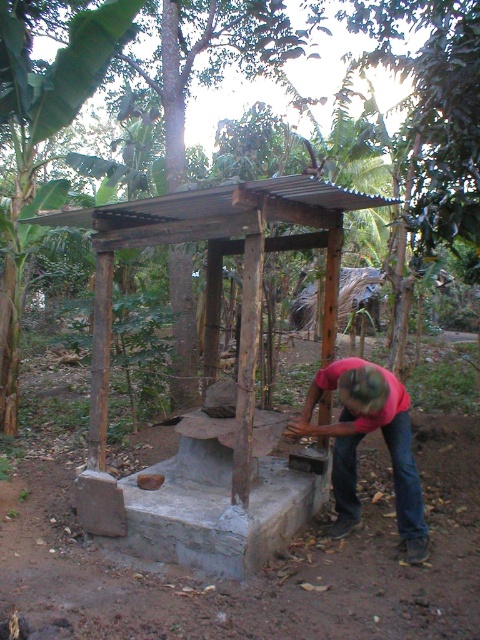
Question: Observing the image, what is the correct spatial positioning of rustic wooden gazebo at center in reference to red fabric shirt at center?

Choices:
 (A) right
 (B) left

Answer: (B)

Question: Which point appears closest to the camera in this image?

Choices:
 (A) (310, 390)
 (B) (100, 422)

Answer: (A)

Question: Which object is farther from the camera taking this photo?

Choices:
 (A) red fabric shirt at center
 (B) rustic wooden gazebo at center

Answer: (A)

Question: Which point is closer to the camera?

Choices:
 (A) (316, 378)
 (B) (252, 266)

Answer: (B)

Question: Considering the relative positions of rustic wooden gazebo at center and red fabric shirt at center in the image provided, where is rustic wooden gazebo at center located with respect to red fabric shirt at center?

Choices:
 (A) right
 (B) left

Answer: (B)

Question: Can you confirm if rustic wooden gazebo at center is positioned to the left of red fabric shirt at center?

Choices:
 (A) no
 (B) yes

Answer: (B)